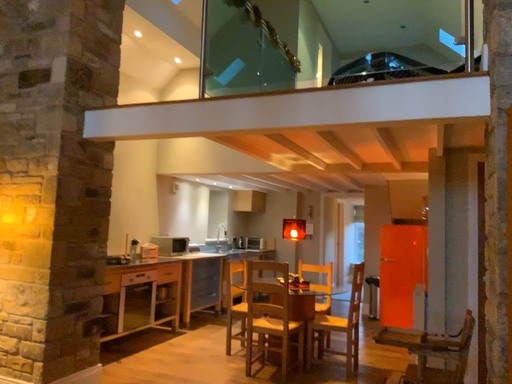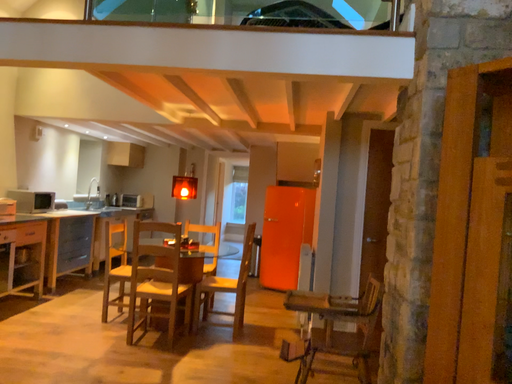
Question: Which way did the camera rotate in the video?

Choices:
 (A) rotated right
 (B) rotated left

Answer: (A)